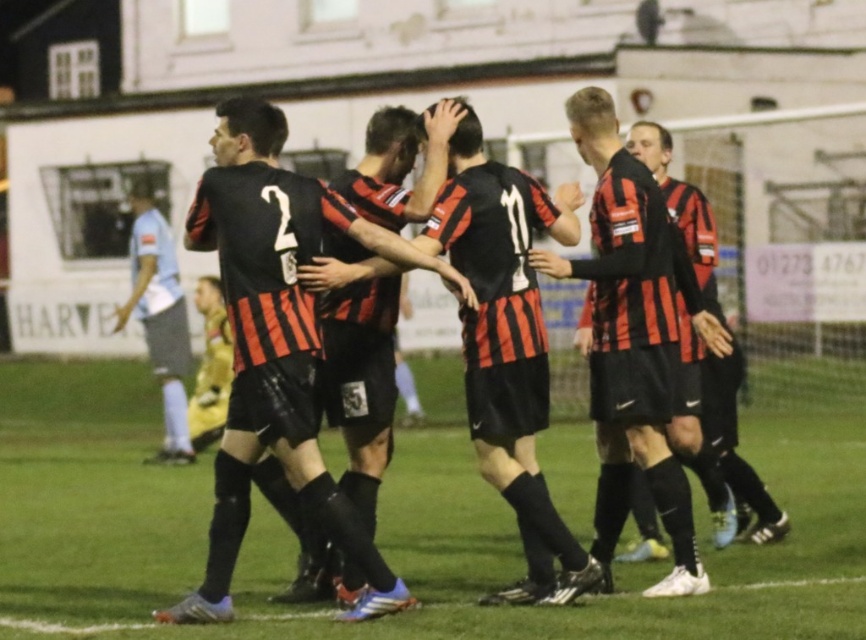
Is black matte jersey at center below matte black jersey at center?

Yes.

Does black matte jersey at center have a larger size compared to matte black jersey at center?

Yes.

Is point (305, 410) behind point (651, 240)?

That is False.

In order to click on black matte jersey at center in this screenshot , I will do `click(283, 353)`.

Does green grass at center appear on the left side of matte black jersey at center?

Indeed, green grass at center is positioned on the left side of matte black jersey at center.

Can you confirm if green grass at center is positioned to the right of matte black jersey at center?

No, green grass at center is not to the right of matte black jersey at center.

What do you see at coordinates (383, 531) in the screenshot?
I see `green grass at center` at bounding box center [383, 531].

This screenshot has width=866, height=640. In order to click on green grass at center in this screenshot , I will do `click(383, 531)`.

Does green grass at center have a greater width compared to black matte jersey at center?

Yes.

Is point (18, 493) positioned behind point (301, 388)?

Yes, it is.

The height and width of the screenshot is (640, 866). What do you see at coordinates (383, 531) in the screenshot? I see `green grass at center` at bounding box center [383, 531].

Where is `green grass at center`? The width and height of the screenshot is (866, 640). green grass at center is located at coordinates point(383,531).